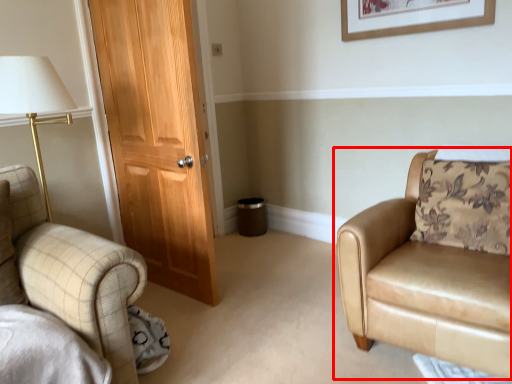
Question: From the image's perspective, what is the correct spatial positioning of chair (annotated by the red box) in reference to picture frame?

Choices:
 (A) below
 (B) above

Answer: (A)